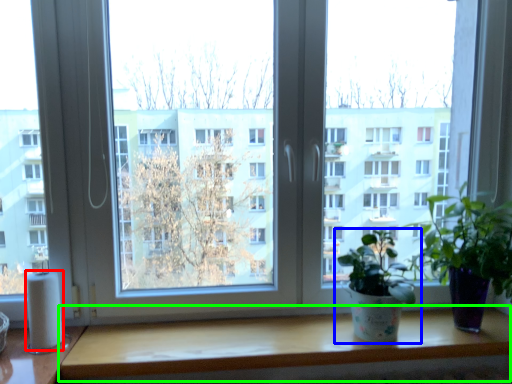
Question: Considering the real-world distances, which object is farthest from toilet paper (highlighted by a red box)? houseplant (highlighted by a blue box) or table (highlighted by a green box)?

Choices:
 (A) houseplant
 (B) table

Answer: (A)